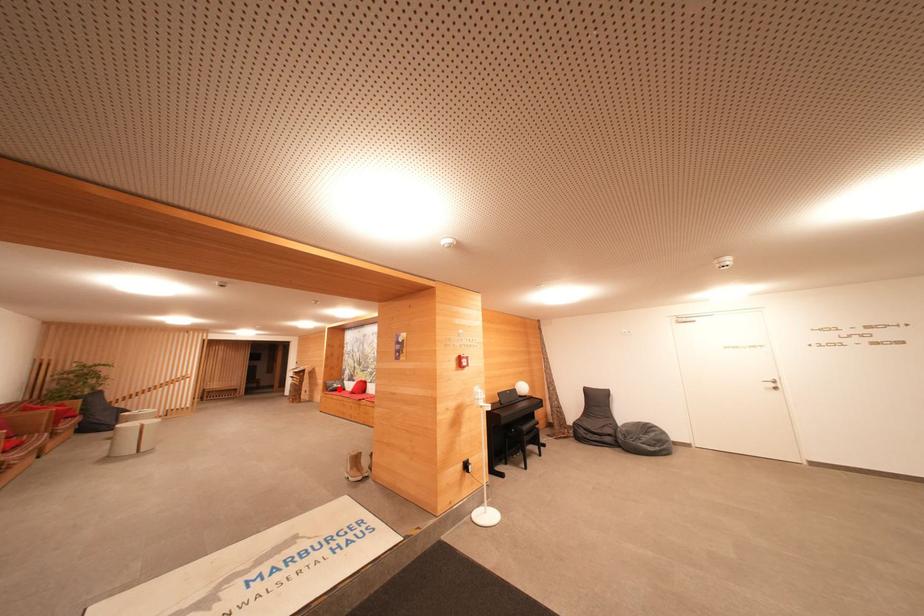
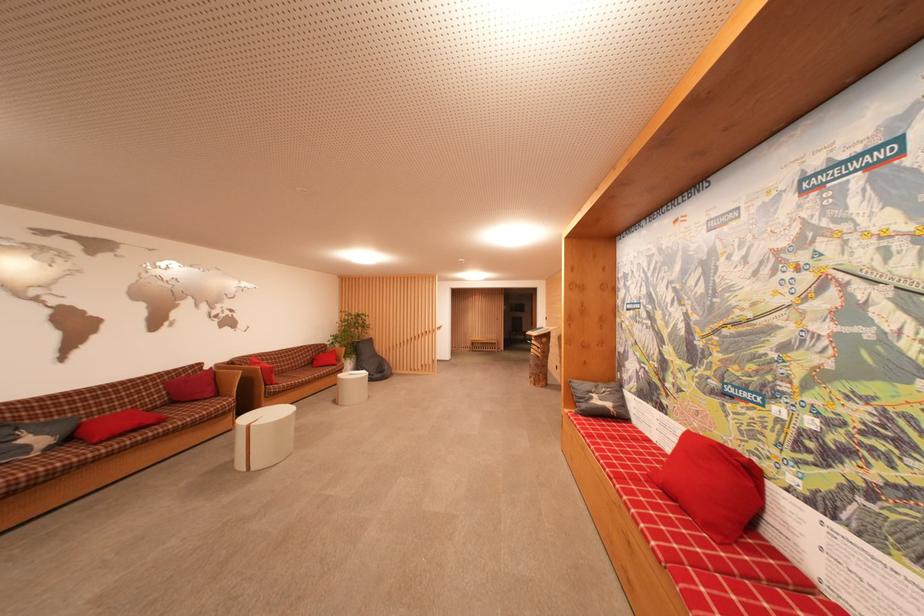
Where in the second image is the point corresponding to the highlighted location from the first image?

(601, 405)